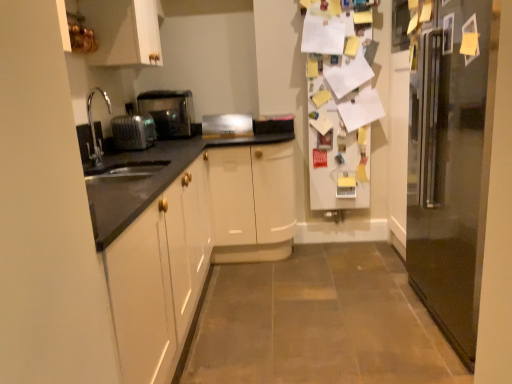
Locate an element on the screen. The height and width of the screenshot is (384, 512). blank space to the left of metallic stainless steel refrigerator at right is located at coordinates (352, 317).